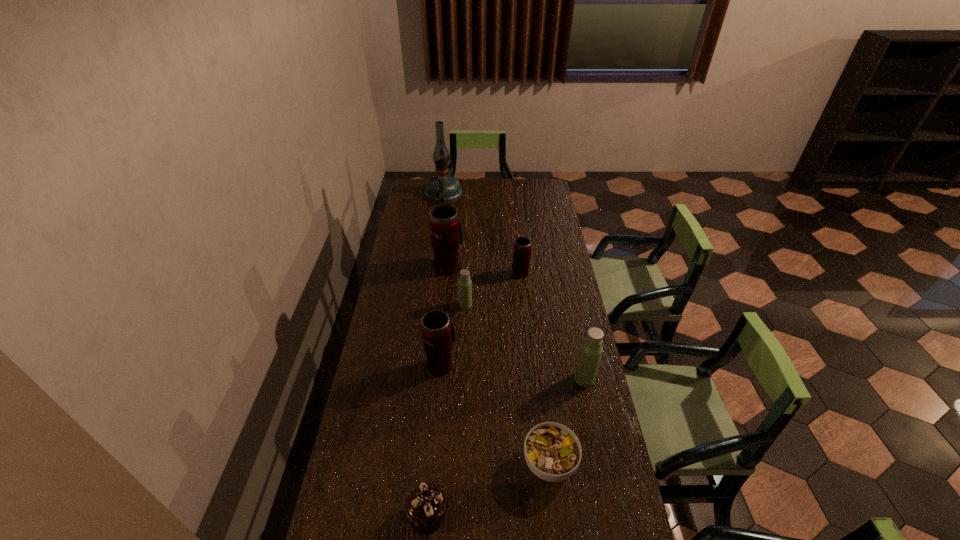
Locate an element on the screen. The height and width of the screenshot is (540, 960). object that is the fifth closest to the left light thermos bottle is located at coordinates (552, 451).

The image size is (960, 540). I want to click on object that is the sixth closest to the nearest red thermos bottle, so coord(522,248).

The width and height of the screenshot is (960, 540). I want to click on thermos bottle that is the closest one to the second tallest object, so click(465, 284).

Identify the location of thermos bottle that stands as the third closest to the tallest object. This screenshot has width=960, height=540. (465, 284).

Where is `red thermos bottle that is the third closest to the tallest object`? This screenshot has width=960, height=540. red thermos bottle that is the third closest to the tallest object is located at coordinates (438, 332).

Choose which red thermos bottle is the second nearest neighbor to the bigger light thermos bottle. Please provide its 2D coordinates. Your answer should be formatted as a tuple, i.e. [(x, y)], where the tuple contains the x and y coordinates of a point satisfying the conditions above.

[(522, 248)]

The width and height of the screenshot is (960, 540). Identify the location of free space that satisfies the following two spatial constraints: 1. on the front side of the nearest object; 2. on the left side of the oil lamp. (404, 516).

This screenshot has height=540, width=960. In order to click on vacant space that satisfies the following two spatial constraints: 1. on the side with the handle of the nearest red thermos bottle; 2. on the left side of the fourth farthest object in this screenshot , I will do `click(445, 305)`.

The height and width of the screenshot is (540, 960). Identify the location of free point that satisfies the following two spatial constraints: 1. on the front side of the third nearest thermos bottle; 2. on the left side of the right light thermos bottle. (463, 379).